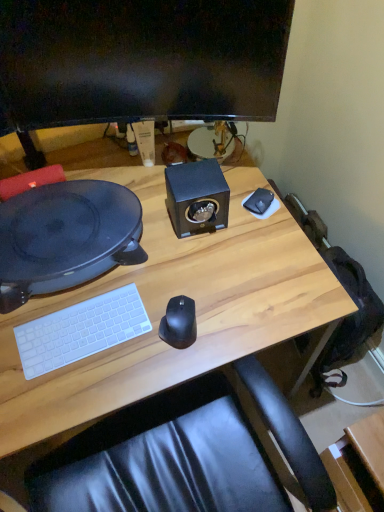
Locate an element on the screen. empty space that is to the right of black matte mouse at center is located at coordinates [x=240, y=313].